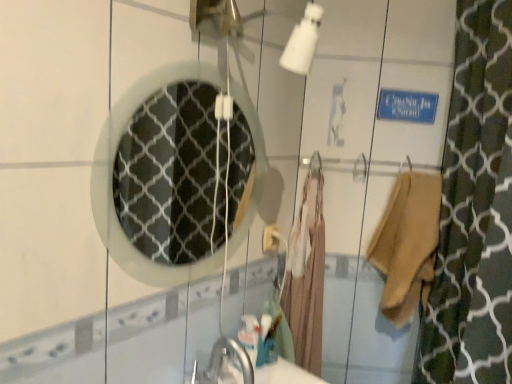
Question: Is white textured mirror at center turned away from beige cotton robe at right?

Choices:
 (A) no
 (B) yes

Answer: (A)

Question: Is white textured mirror at center smaller than beige cotton robe at right?

Choices:
 (A) yes
 (B) no

Answer: (A)

Question: From the image's perspective, is white textured mirror at center on beige cotton robe at right?

Choices:
 (A) yes
 (B) no

Answer: (A)

Question: Considering the relative sizes of white textured mirror at center and beige cotton robe at right in the image provided, is white textured mirror at center bigger than beige cotton robe at right?

Choices:
 (A) yes
 (B) no

Answer: (B)

Question: Is white textured mirror at center completely or partially outside of beige cotton robe at right?

Choices:
 (A) yes
 (B) no

Answer: (A)

Question: Is white textured mirror at center taller than beige cotton robe at right?

Choices:
 (A) yes
 (B) no

Answer: (A)

Question: Is beige fabric bathrobe at center facing towards beige cotton robe at right?

Choices:
 (A) yes
 (B) no

Answer: (B)

Question: Considering the relative positions of beige fabric bathrobe at center and beige cotton robe at right in the image provided, is beige fabric bathrobe at center behind beige cotton robe at right?

Choices:
 (A) yes
 (B) no

Answer: (A)

Question: Is beige fabric bathrobe at center far away from beige cotton robe at right?

Choices:
 (A) yes
 (B) no

Answer: (B)

Question: Is beige fabric bathrobe at center at the right side of beige cotton robe at right?

Choices:
 (A) yes
 (B) no

Answer: (B)

Question: Is beige fabric bathrobe at center placed right next to beige cotton robe at right?

Choices:
 (A) no
 (B) yes

Answer: (A)

Question: From the image's perspective, is beige fabric bathrobe at center over beige cotton robe at right?

Choices:
 (A) yes
 (B) no

Answer: (B)

Question: Does beige cotton robe at right appear on the left side of beige fabric bathrobe at center?

Choices:
 (A) yes
 (B) no

Answer: (B)